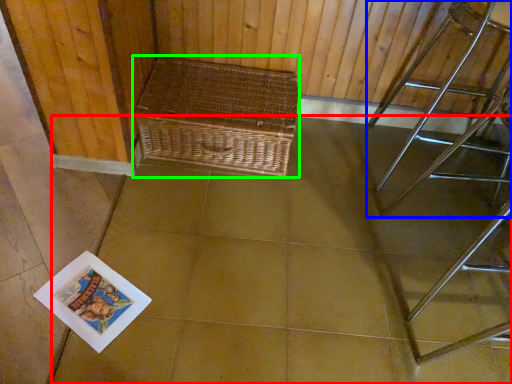
Question: Estimate the real-world distances between objects in this image. Which object is farther from square (highlighted by a red box), furniture (highlighted by a blue box) or picnic basket (highlighted by a green box)?

Choices:
 (A) furniture
 (B) picnic basket

Answer: (A)